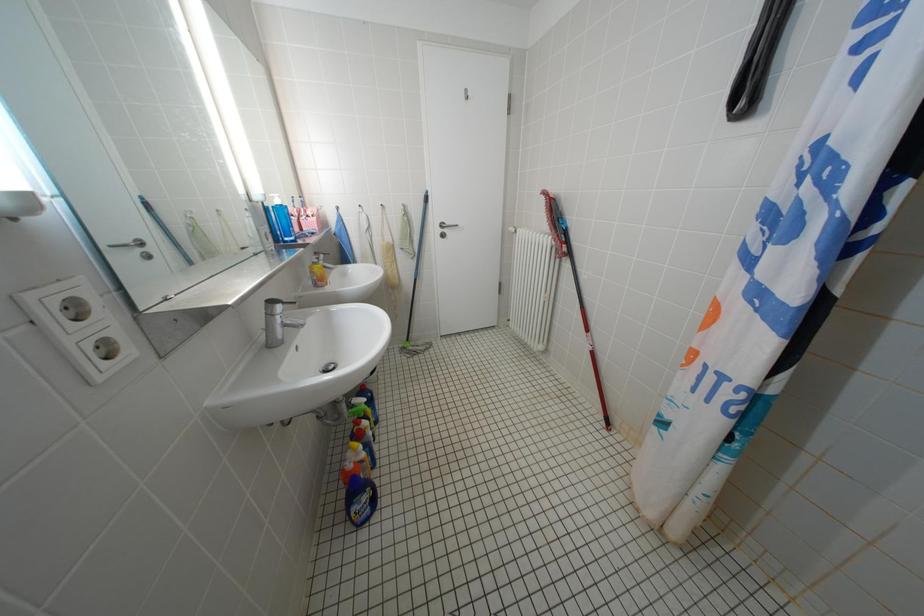
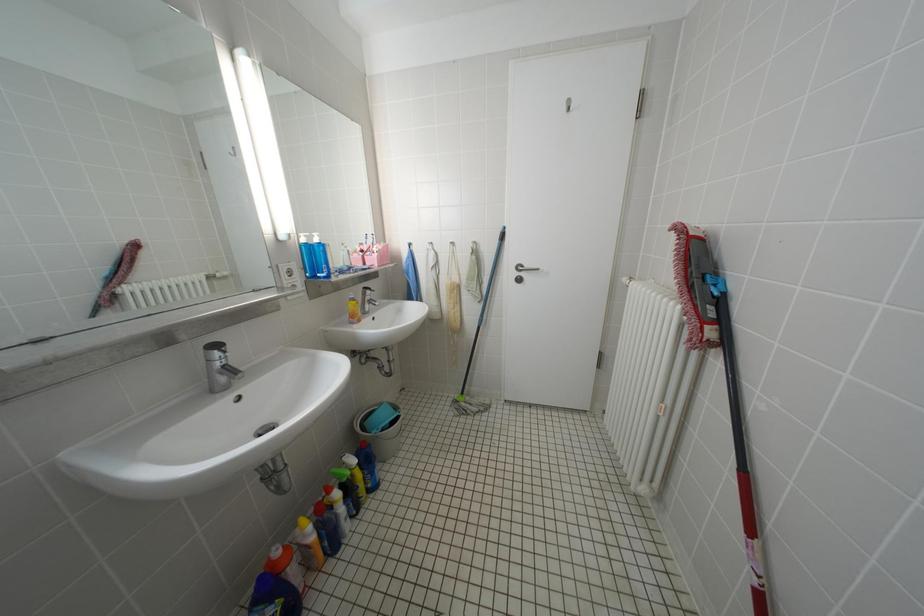
Question: The camera is either moving clockwise (left) or counter-clockwise (right) around the object. The first image is from the beginning of the video and the second image is from the end. Is the camera moving left or right when shooting the video?

Choices:
 (A) Left
 (B) Right

Answer: (B)